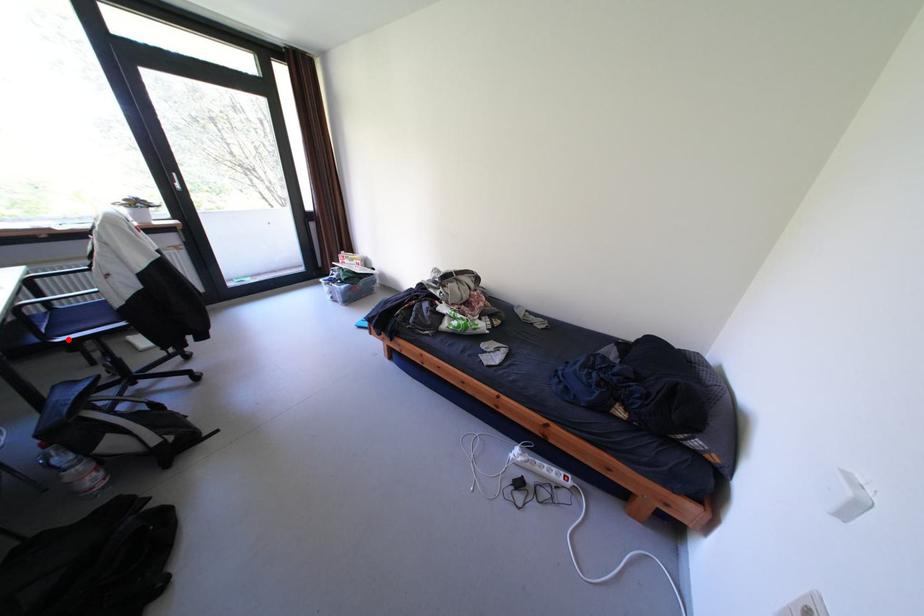
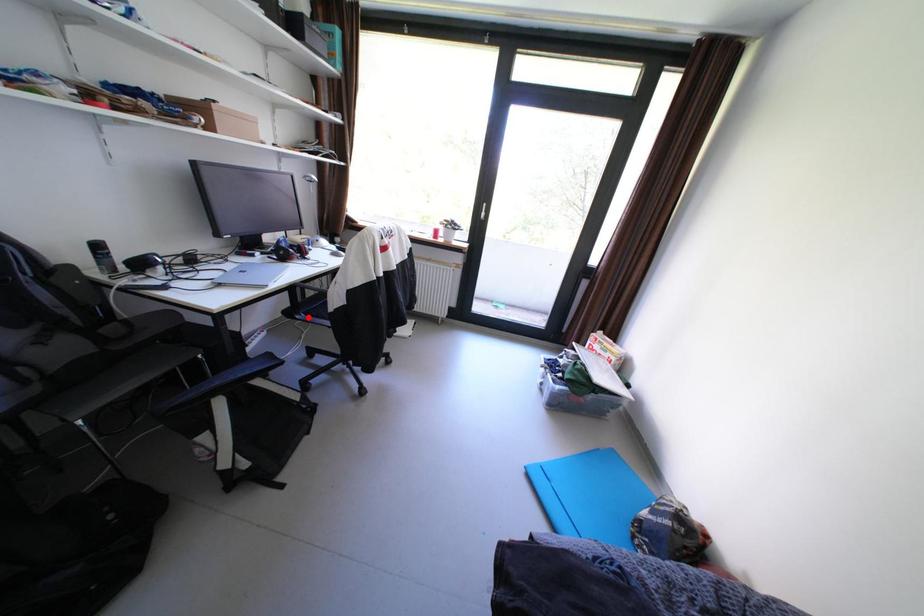
I am providing you with two images of the same scene from different viewpoints. A red point is marked on the first image and another point is marked on the second image. Is the marked point in image1 the same physical position as the marked point in image2?

Yes